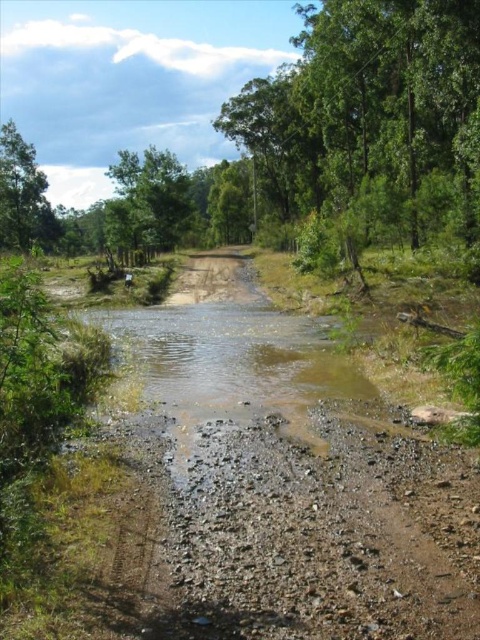
What do you see at coordinates (149, 196) in the screenshot?
I see `green leafy tree at center` at bounding box center [149, 196].

Where is `green leafy tree at center`? The width and height of the screenshot is (480, 640). green leafy tree at center is located at coordinates (149, 196).

Who is more forward, (134, 212) or (48, 240)?

Point (134, 212) is in front.

At what (x,y) coordinates should I click in order to perform the action: click on green leafy tree at center. Please return your answer as a coordinate pair (x, y). Image resolution: width=480 pixels, height=640 pixels. Looking at the image, I should click on (149, 196).